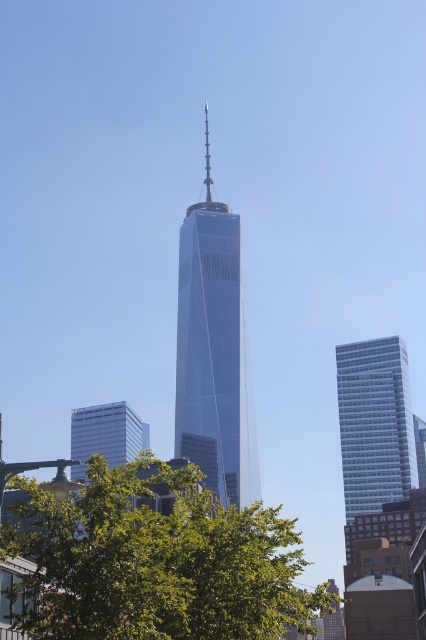
Can you confirm if glassy steel skyscraper at center is positioned above white glass building at right?

Indeed, glassy steel skyscraper at center is positioned over white glass building at right.

Does point (215, 323) lie in front of point (342, 448)?

Yes, point (215, 323) is in front of point (342, 448).

Find the location of a particular element. Image resolution: width=426 pixels, height=640 pixels. glassy steel skyscraper at center is located at coordinates click(x=215, y=353).

Where is `green leafy tree at center`? This screenshot has width=426, height=640. green leafy tree at center is located at coordinates (157, 561).

Does green leafy tree at center appear under glassy steel skyscraper at center?

Yes.

What do you see at coordinates (157, 561) in the screenshot? I see `green leafy tree at center` at bounding box center [157, 561].

I want to click on green leafy tree at center, so click(x=157, y=561).

Can you confirm if green leafy tree at center is shorter than white glass building at right?

Correct, green leafy tree at center is not as tall as white glass building at right.

Is green leafy tree at center to the right of white glass building at right from the viewer's perspective?

No, green leafy tree at center is not to the right of white glass building at right.

Measure the distance between point [178,602] and camera.

They are 63.65 meters apart.

Where is `green leafy tree at center`? The height and width of the screenshot is (640, 426). green leafy tree at center is located at coordinates (157, 561).